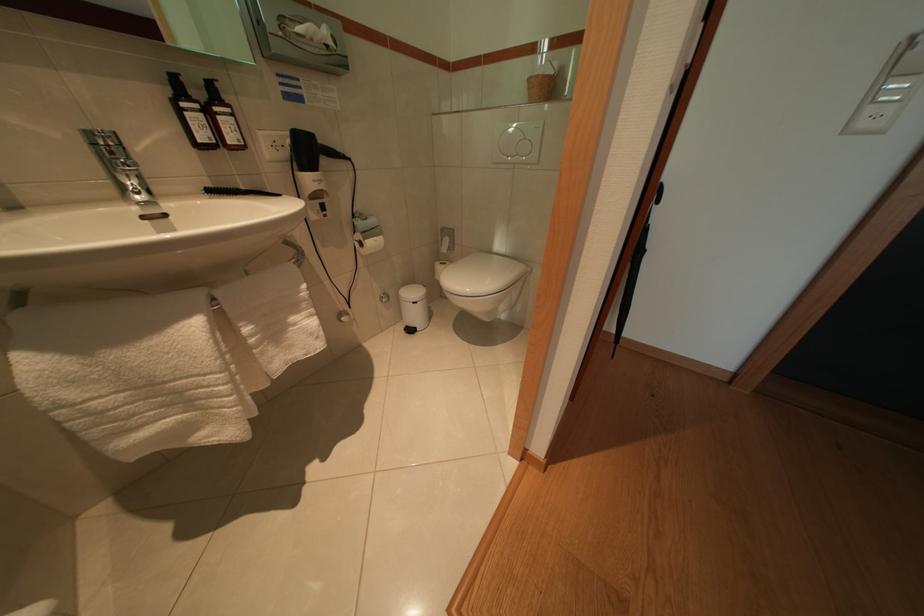
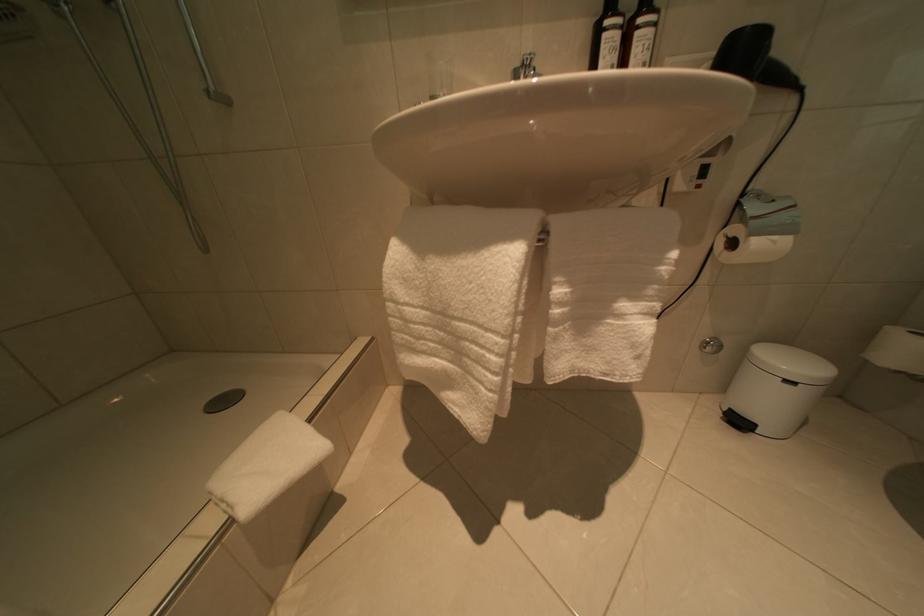
In the second image, find the point that corresponds to point (202, 333) in the first image.

(517, 262)